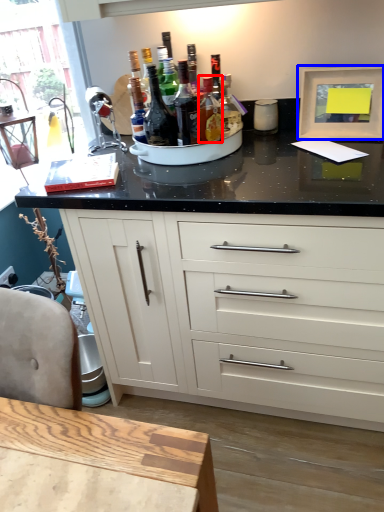
Question: Which of the following is the closest to the observer, bottle (highlighted by a red box) or picture frame (highlighted by a blue box)?

Choices:
 (A) bottle
 (B) picture frame

Answer: (A)